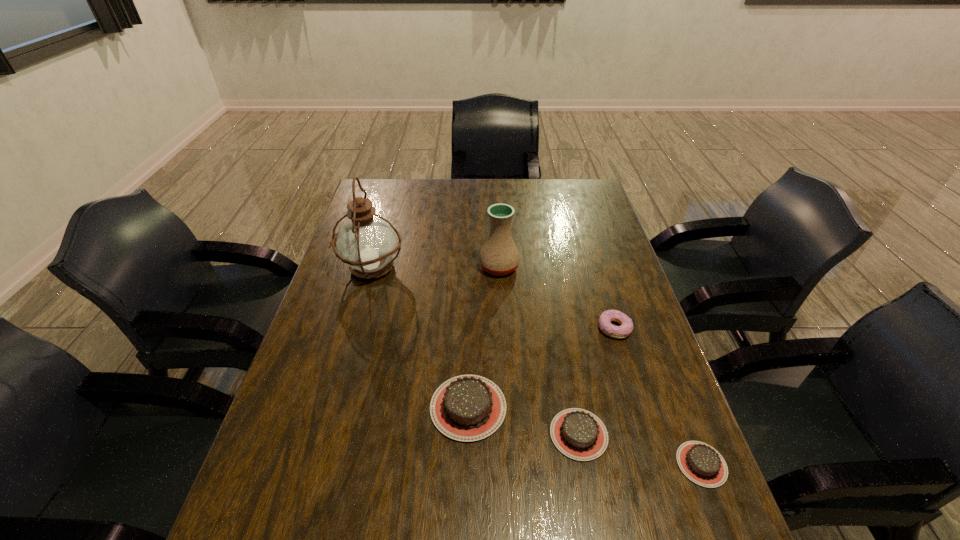
Where is `vacant place for an extra chocolate cake on the left`? The height and width of the screenshot is (540, 960). vacant place for an extra chocolate cake on the left is located at coordinates (368, 383).